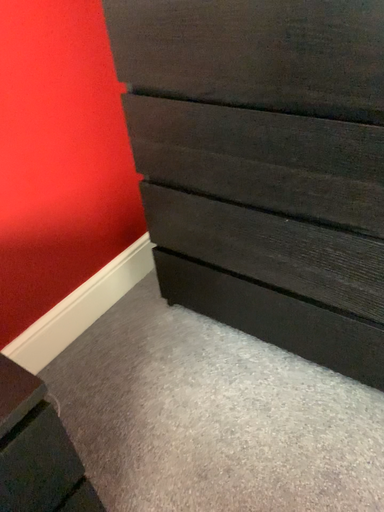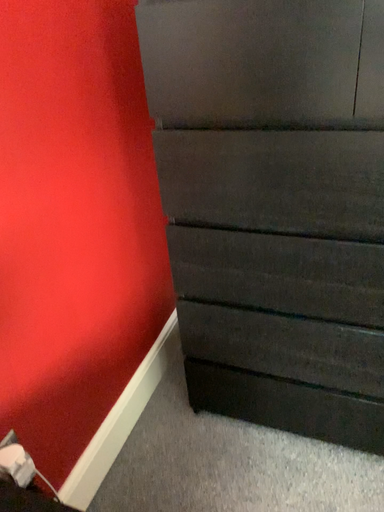
Question: Which way did the camera rotate in the video?

Choices:
 (A) rotated downward
 (B) rotated upward

Answer: (B)